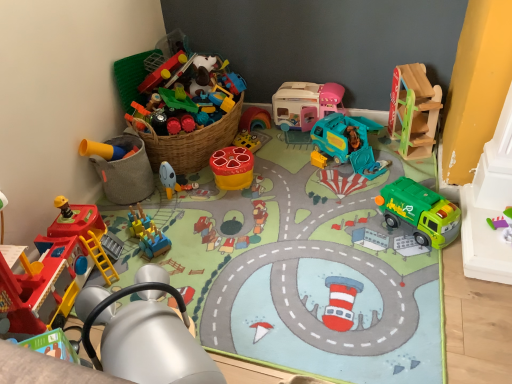
Locate an element on the screen. free space to the left of pastel pink plastic camper at center, which ranks as the fourth toy in right-to-left order is located at coordinates (274, 138).